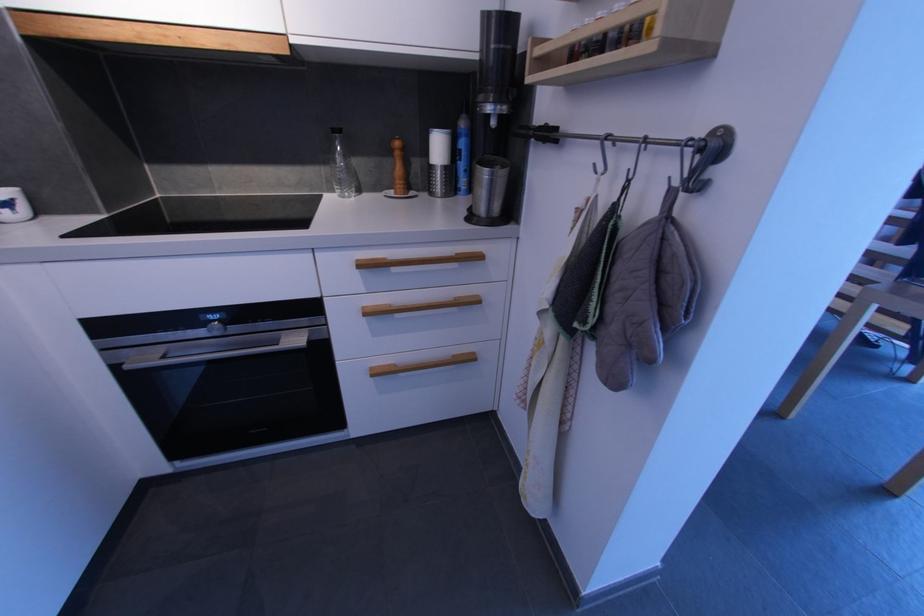
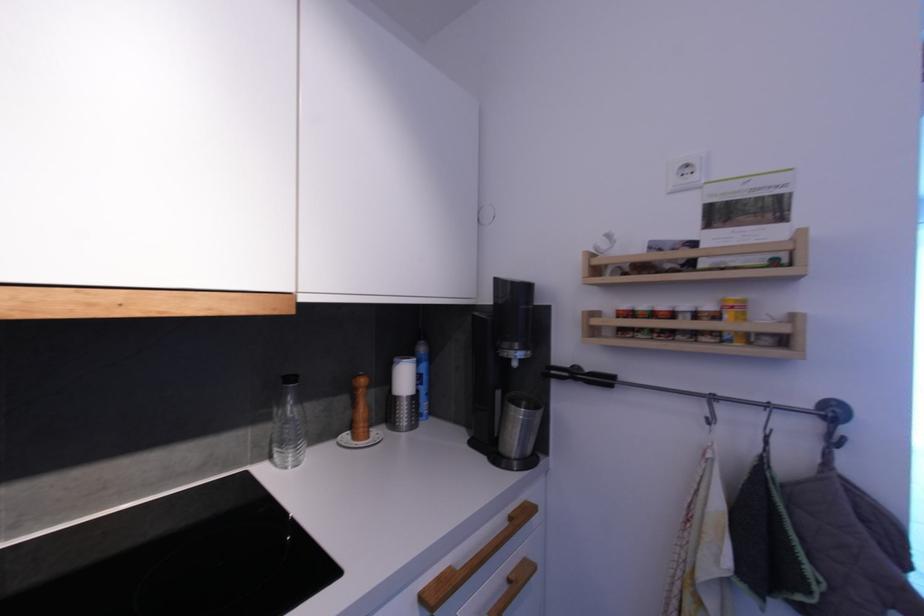
In the second image, find the point that corresponds to the point at 343,132 in the first image.

(295, 381)